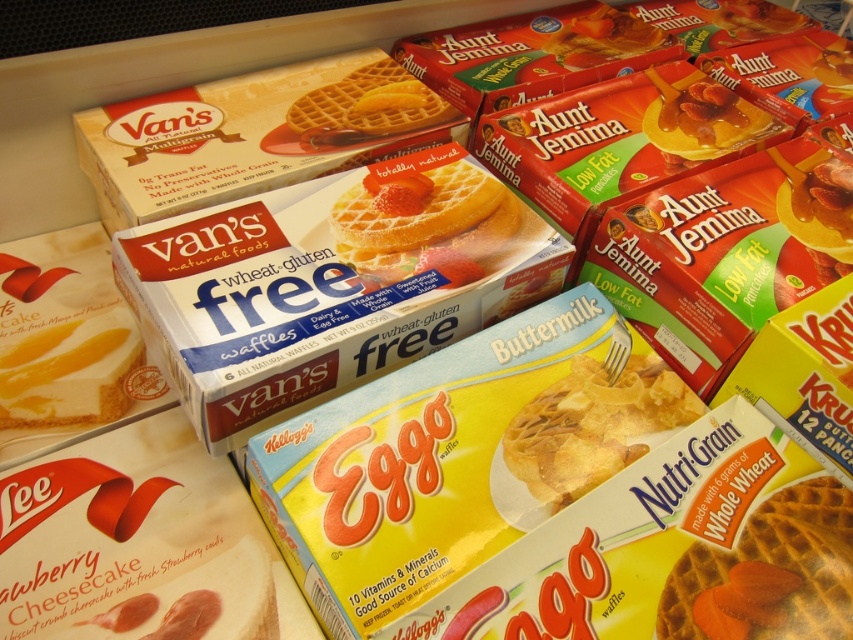
Is the position of whole wheat waffle at center more distant than that of totally natural yellow waffle at center?

That is False.

Which is behind, point (827, 552) or point (404, 243)?

Point (404, 243)

You are a GUI agent. You are given a task and a screenshot of the screen. Output one action in this format:
    pyautogui.click(x=<x>, y=<y>)
    Task: Click on the whole wheat waffle at center
    The height and width of the screenshot is (640, 853).
    Given the screenshot: What is the action you would take?
    pyautogui.click(x=769, y=572)

Between point (734, 586) and point (657, 422), which one is positioned behind?

The point (657, 422) is more distant.

Does whole wheat waffle at center have a greater width compared to yellow matte waffle at center?

No.

Where is `whole wheat waffle at center`? The image size is (853, 640). whole wheat waffle at center is located at coordinates (769, 572).

Locate an element on the screen. This screenshot has width=853, height=640. whole wheat waffle at center is located at coordinates pos(769,572).

Between whole wheat waffle at center and matte cardboard waffle at center, which one appears on the left side from the viewer's perspective?

From the viewer's perspective, matte cardboard waffle at center appears more on the left side.

Which is in front, point (817, 596) or point (386, 97)?

Positioned in front is point (817, 596).

Does point (798, 570) come closer to viewer compared to point (383, 90)?

Yes, it is in front of point (383, 90).

Where is `whole wheat waffle at center`? This screenshot has height=640, width=853. whole wheat waffle at center is located at coordinates (769, 572).